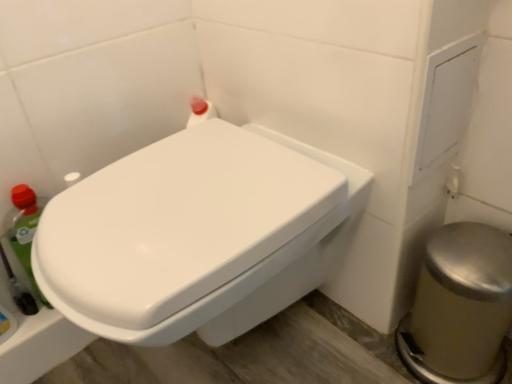
The width and height of the screenshot is (512, 384). Find the location of `free space above white glossy toilet at center (from a real-world perspective)`. free space above white glossy toilet at center (from a real-world perspective) is located at coordinates (187, 193).